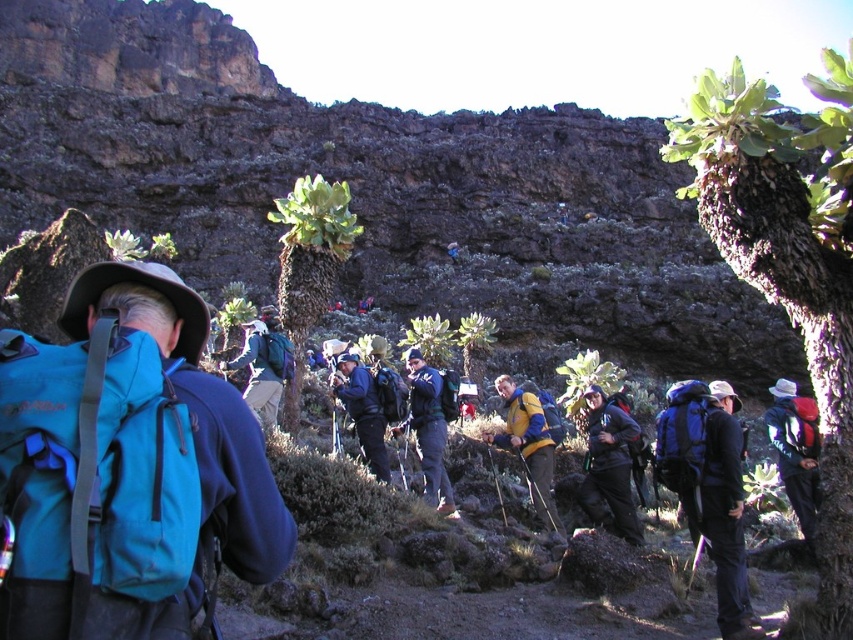
Question: Can you confirm if dark gray fabric backpack at center is positioned below yellowmaterialjacket at center?

Choices:
 (A) yes
 (B) no

Answer: (B)

Question: Estimate the real-world distances between objects in this image. Which object is farther from the black fabric jacket at center-right?

Choices:
 (A) blue fabric jacket at center
 (B) teal fabric backpack at center
 (C) dark gray fabric backpack at center

Answer: (B)

Question: Which point is closer to the camera?

Choices:
 (A) (434, 198)
 (B) (808, 397)
 (C) (599, 401)

Answer: (C)

Question: Which point is farther to the camera?

Choices:
 (A) (257, 412)
 (B) (119, 428)

Answer: (A)

Question: Is matte blue jacket at center thinner than teal fabric backpack at center?

Choices:
 (A) yes
 (B) no

Answer: (A)

Question: Does brown rocky hillside at center lie behind matte blue jacket at center?

Choices:
 (A) no
 (B) yes

Answer: (B)